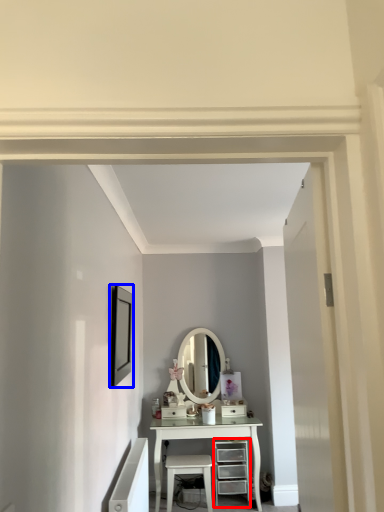
Question: Which object is further to the camera taking this photo, chest of drawers (highlighted by a red box) or picture frame (highlighted by a blue box)?

Choices:
 (A) chest of drawers
 (B) picture frame

Answer: (A)